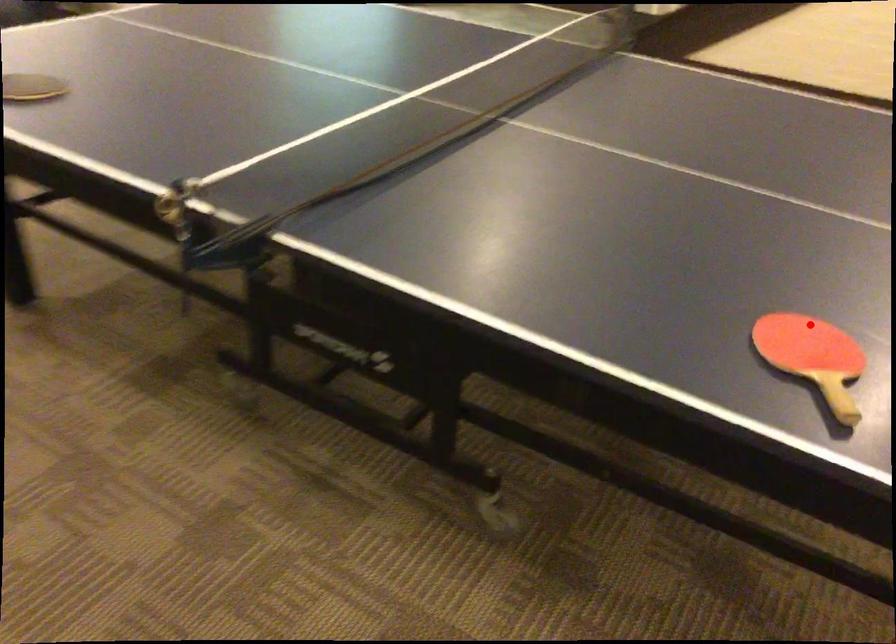
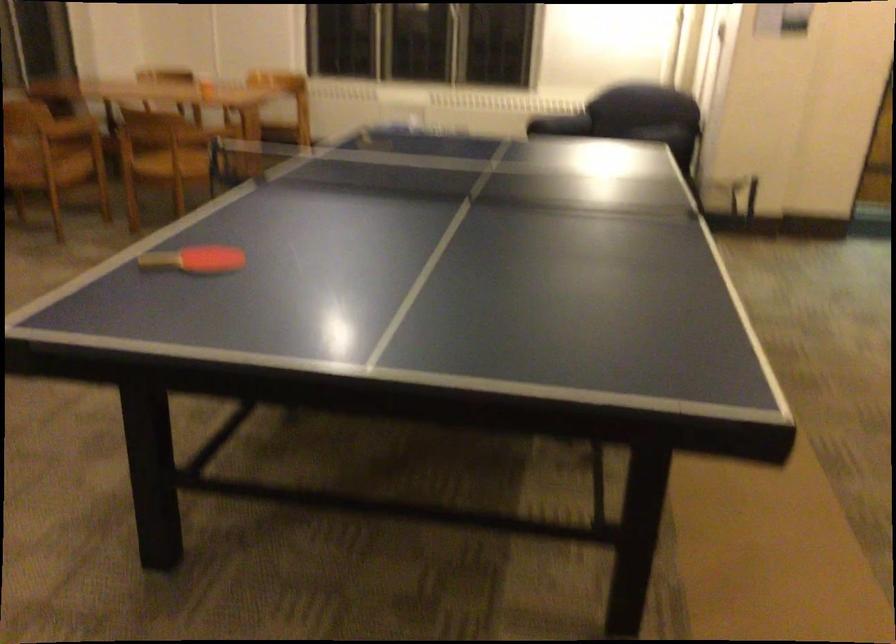
Where in the second image is the point corresponding to the highlighted location from the first image?

(194, 259)